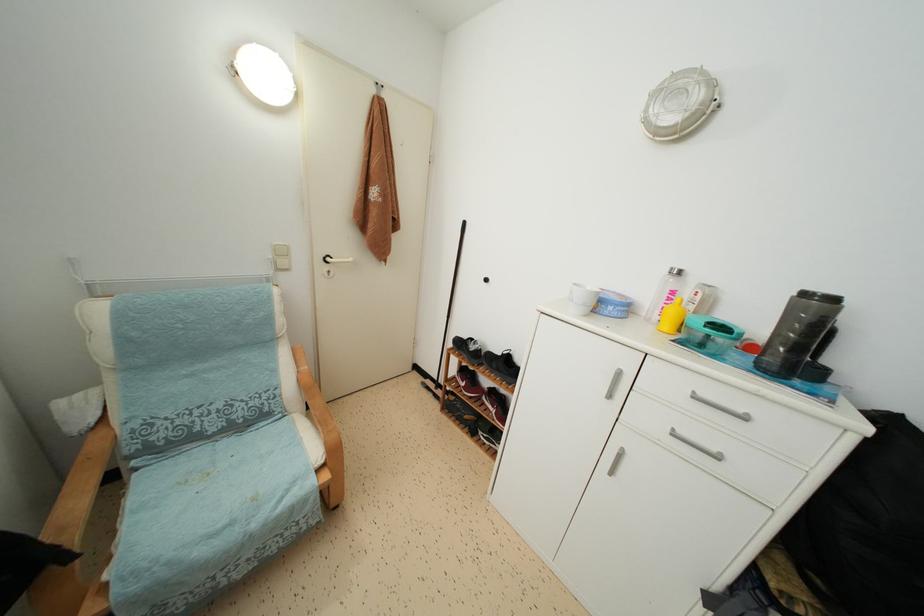
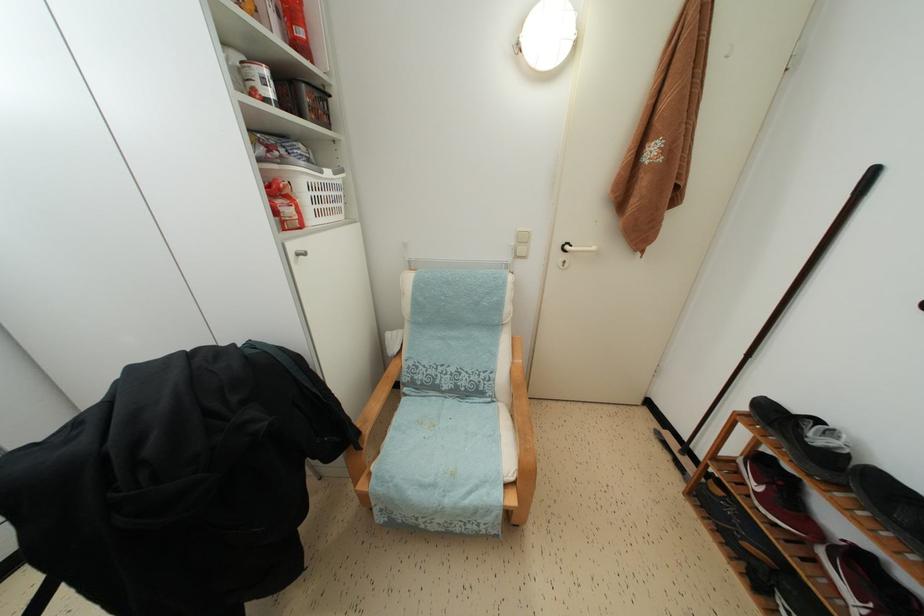
In the second image, find the point that corresponds to the point at 374,232 in the first image.

(638, 207)